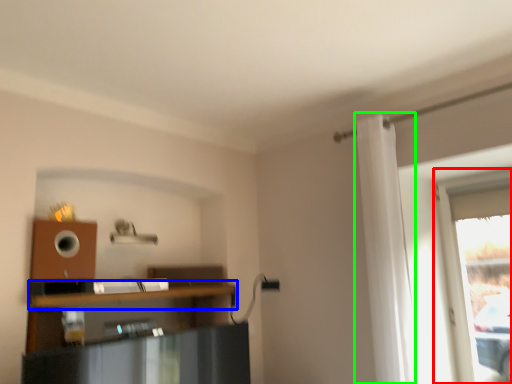
Question: Based on their relative distances, which object is nearer to window (highlighted by a red box)? Choose from shelf (highlighted by a blue box) and curtain (highlighted by a green box).

Choices:
 (A) shelf
 (B) curtain

Answer: (B)